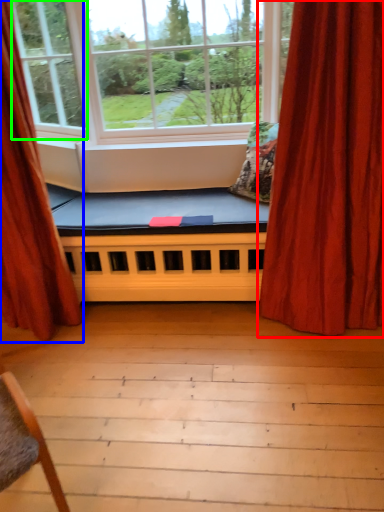
Question: Which is nearer to the curtain (highlighted by a red box)? curtain (highlighted by a blue box) or window (highlighted by a green box).

Choices:
 (A) curtain
 (B) window

Answer: (A)